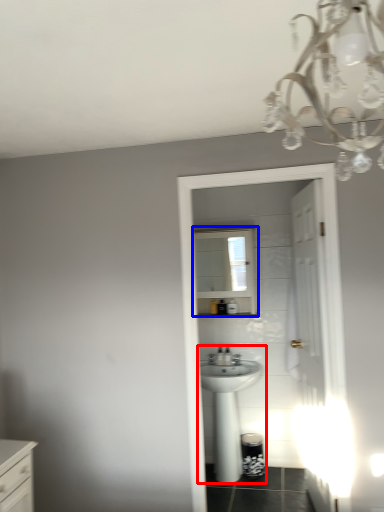
Question: Among these objects, which one is nearest to the camera, sink (highlighted by a red box) or medicine cabinet (highlighted by a blue box)?

Choices:
 (A) sink
 (B) medicine cabinet

Answer: (A)